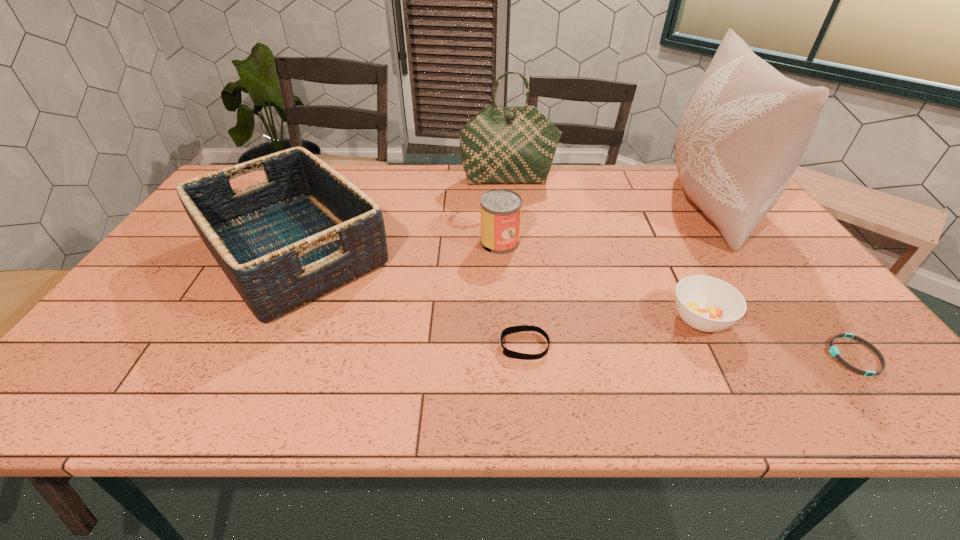
This screenshot has width=960, height=540. I want to click on free space that satisfies the following two spatial constraints: 1. on the front side of the cushion; 2. on the front side of the leftmost object, so click(739, 251).